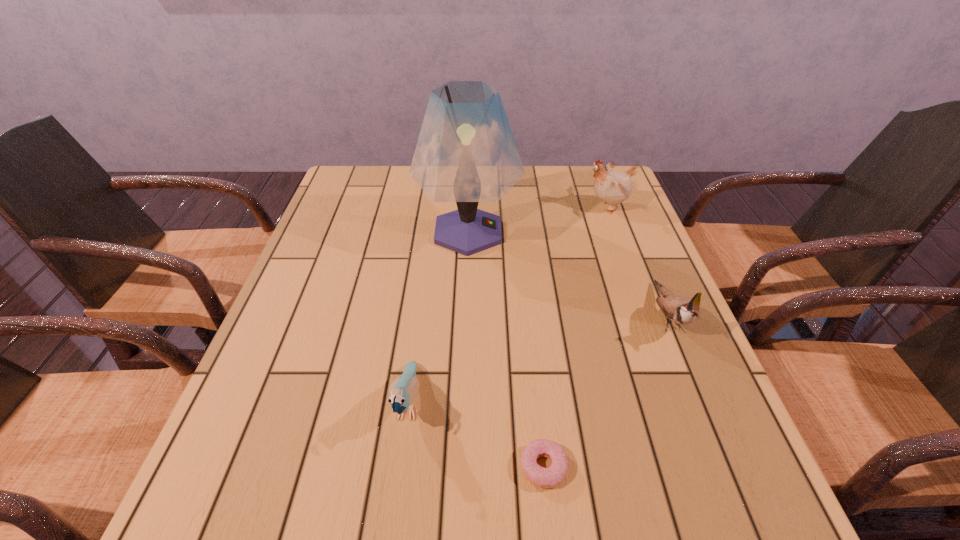
Find the location of a particular element. This screenshot has height=540, width=960. vacant area that lies between the second farthest bird and the leftmost bird is located at coordinates (538, 359).

Image resolution: width=960 pixels, height=540 pixels. In order to click on free space that is in between the farthest bird and the shortest object in this screenshot , I will do tap(575, 337).

Locate an element on the screen. empty space that is in between the tallest object and the shortest object is located at coordinates (506, 349).

You are a GUI agent. You are given a task and a screenshot of the screen. Output one action in this format:
    pyautogui.click(x=<x>, y=<y>)
    Task: Click on the free space between the farthest bird and the third farthest object
    The width and height of the screenshot is (960, 540).
    Given the screenshot: What is the action you would take?
    pyautogui.click(x=637, y=261)

Image resolution: width=960 pixels, height=540 pixels. Find the location of `vacant point located between the farthest bird and the second nearest bird`. vacant point located between the farthest bird and the second nearest bird is located at coordinates (637, 261).

Image resolution: width=960 pixels, height=540 pixels. I want to click on free space between the third farthest object and the tallest object, so click(x=567, y=274).

Locate an element on the screen. This screenshot has height=540, width=960. free space between the nearest bird and the lampshade is located at coordinates (439, 318).

Identify the location of empty space that is in between the lampshade and the leftmost bird. (439, 318).

You are a GUI agent. You are given a task and a screenshot of the screen. Output one action in this format:
    pyautogui.click(x=<x>, y=<y>)
    Task: Click on the vacant space in between the shortest object and the farthest bird
    
    Given the screenshot: What is the action you would take?
    pyautogui.click(x=575, y=337)

Image resolution: width=960 pixels, height=540 pixels. In order to click on empty space between the leftmost bird and the lampshade in this screenshot , I will do `click(439, 318)`.